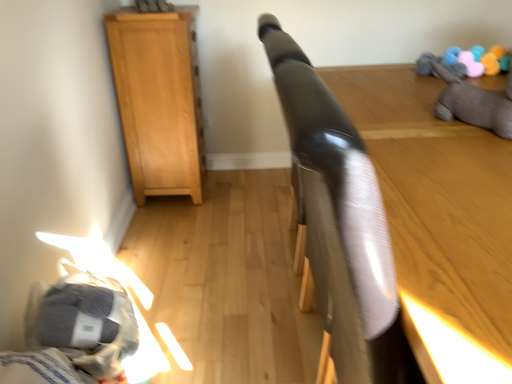
At what (x,y) coordinates should I click in order to perform the action: click on free space to the back side of gray plush toy at upper right. Please return your answer as a coordinate pair (x, y). This screenshot has width=512, height=384. Looking at the image, I should click on (410, 101).